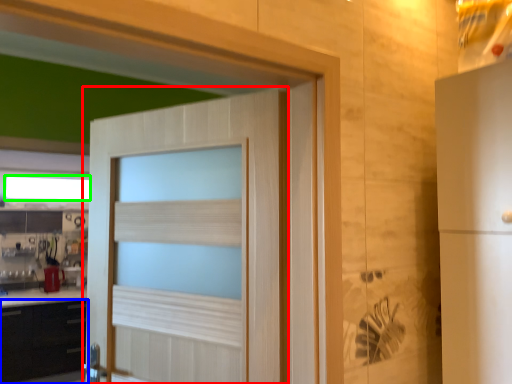
Question: Estimate the real-world distances between objects in this image. Which object is farther from door (highlighted by a red box), cabinetry (highlighted by a blue box) or window (highlighted by a green box)?

Choices:
 (A) cabinetry
 (B) window

Answer: (B)